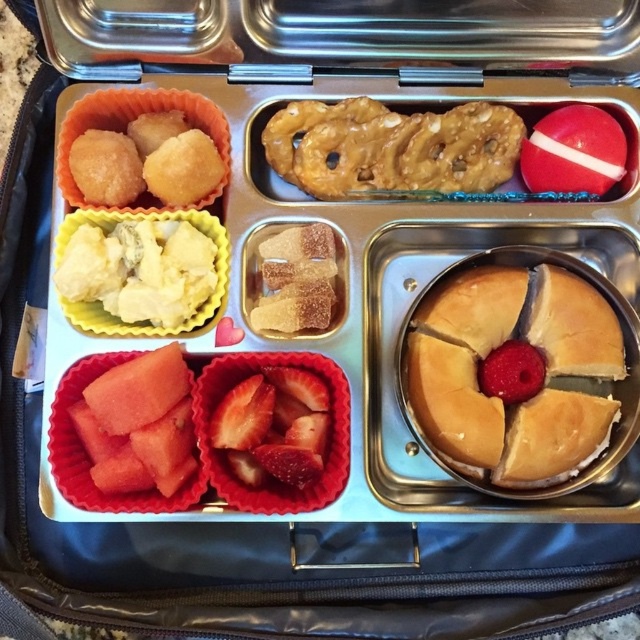
You are a child trying to reach both the strawberrysmoothfruit at center and the matte yellow cupcake at upper left in your bento box. If your hand can only reach 10 inches, can you grab both items without moving your hand?

The strawberrysmoothfruit at center is 11.53 inches away from the matte yellow cupcake at upper left, which is farther than your hand can reach. Therefore, you cannot grab both items without moving your hand.

You are looking at the bento box and want to touch the point labeled point (x=134, y=461) and point (x=308, y=310). Which point will your finger reach first if you extend your hand towards them?

Point (x=134, y=461) is closer to the camera than point (x=308, y=310), so your finger will reach point (x=134, y=461) first.

You are a nutritionist analyzing the bento box. You need to place a divider between the yellow creamy cheese at upper left and the strawberrysmoothfruit at center. What is the minimum length of the divider required to fit between them?

The minimum length of the divider should be at least 6.70 inches to fit between the yellow creamy cheese at upper left and the strawberrysmoothfruit at center.